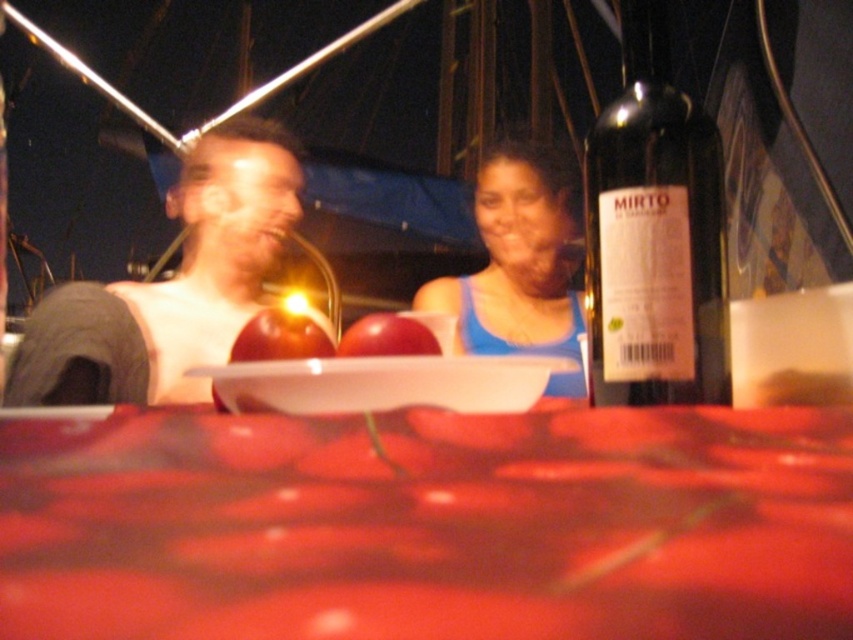
You are at a party and want to take a photo of the blue fabric tank top at center. The camera you are using has a focus point at coordinate point (521, 262). Will this focus point help you capture the blue fabric tank top at center clearly?

Yes, the blue fabric tank top at center is represented by point (521, 262), so the focus point will align with it, allowing for clear capture.

Consider the image. What are the coordinates of the blue fabric tank top at center?

The blue fabric tank top at center is located at coordinates [521,262].

You are a photographer trying to capture the two people in the image. Since the smooth red fabric at center and the blue fabric tank top at center are in the frame, which one should you focus on to ensure the larger object is sharp?

The blue fabric tank top at center is larger than the smooth red fabric at center, so you should focus on the blue fabric tank top at center to ensure the larger object is sharp.